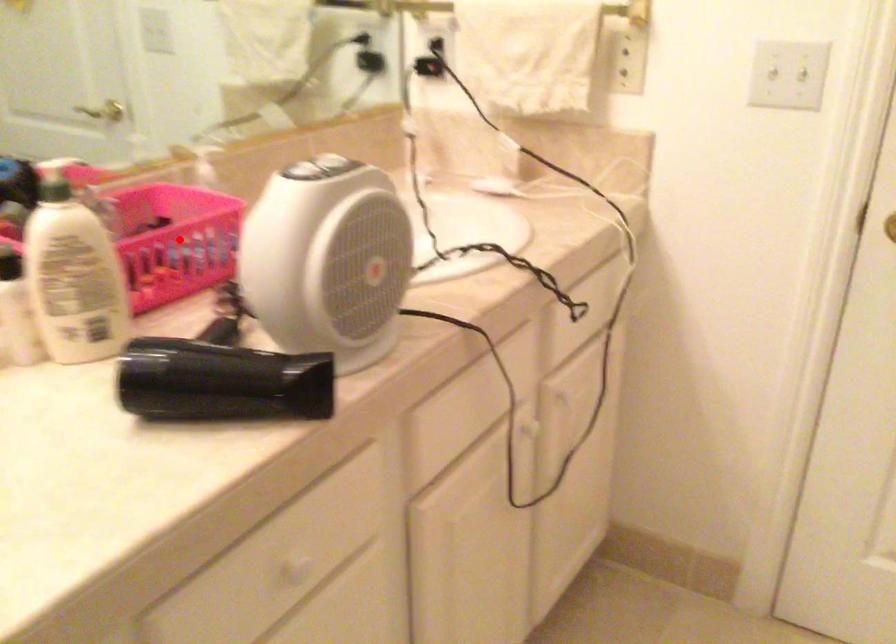
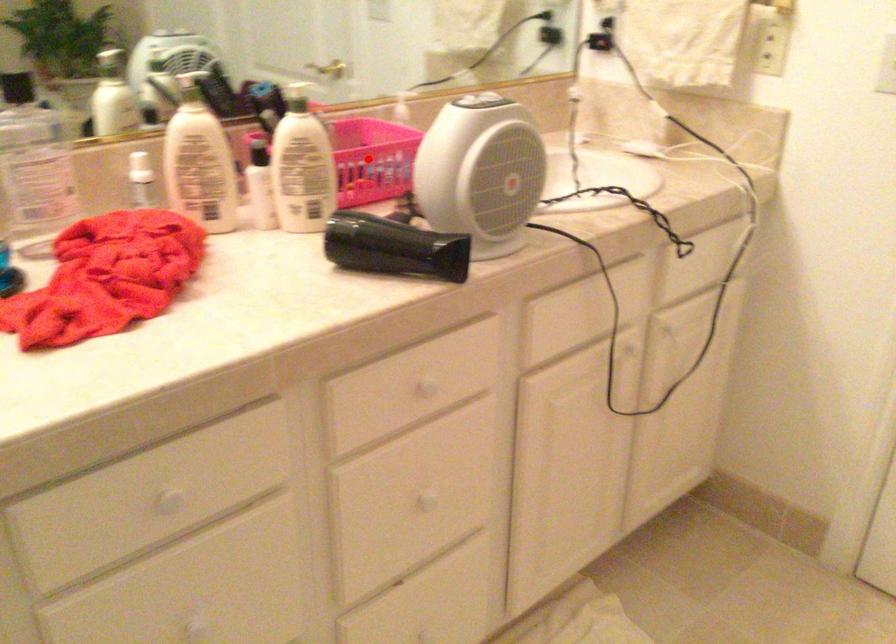
I am providing you with two images of the same scene from different viewpoints. A red point is marked on the first image and another point is marked on the second image. Is the red point in image1 aligned with the point shown in image2?

Yes